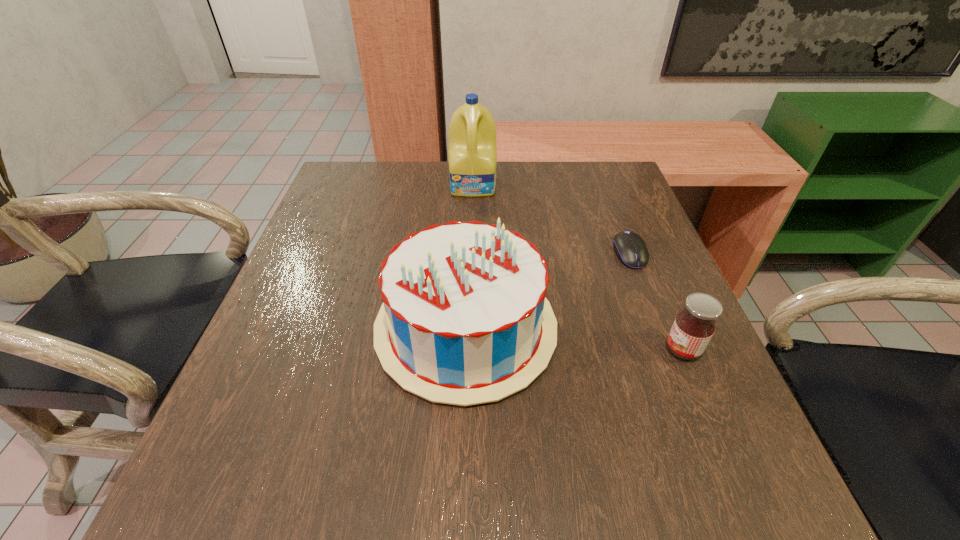
You are a GUI agent. You are given a task and a screenshot of the screen. Output one action in this format:
    pyautogui.click(x=<x>, y=<y>)
    Task: Click on the tallest object
    Image resolution: width=960 pixels, height=540 pixels.
    Given the screenshot: What is the action you would take?
    [472, 152]

The width and height of the screenshot is (960, 540). Identify the location of the farthest object. (472, 152).

Locate an element on the screen. the second tallest object is located at coordinates (464, 320).

At what (x,y) coordinates should I click in order to perform the action: click on the second shortest object. Please return your answer as a coordinate pair (x, y). Image resolution: width=960 pixels, height=540 pixels. Looking at the image, I should click on (694, 326).

You are a GUI agent. You are given a task and a screenshot of the screen. Output one action in this format:
    pyautogui.click(x=<x>, y=<y>)
    Task: Click on the computer mouse
    Image resolution: width=960 pixels, height=540 pixels.
    Given the screenshot: What is the action you would take?
    pyautogui.click(x=630, y=248)

In order to click on vacant region located 0.100m on the label of the tallest object in this screenshot , I will do `click(473, 221)`.

Identify the location of free space located 0.100m on the right of the third shortest object. (610, 328).

Identify the location of free spot located on the label side of the jam. This screenshot has width=960, height=540. (542, 349).

The image size is (960, 540). Find the location of `free location located 0.280m on the label side of the jam`. free location located 0.280m on the label side of the jam is located at coordinates (509, 349).

Locate an element on the screen. vacant space located 0.330m on the label side of the jam is located at coordinates (481, 349).